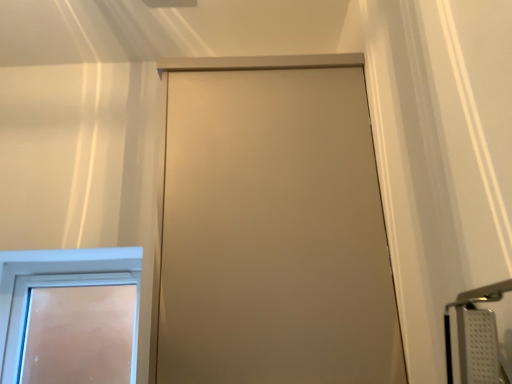
Image resolution: width=512 pixels, height=384 pixels. Describe the element at coordinates (79, 335) in the screenshot. I see `white frosted glass door at lower left, marked as the first door in a back-to-front arrangement` at that location.

Identify the location of white frosted glass door at lower left, which is the 2th door from right to left. The height and width of the screenshot is (384, 512). (79, 335).

Describe the element at coordinates (274, 232) in the screenshot. This screenshot has width=512, height=384. I see `satin beige door at center, acting as the first door starting from the front` at that location.

What is the approximate height of satin beige door at center, which is the second door from left to right?

The height of satin beige door at center, which is the second door from left to right, is 38.23 inches.

Find the location of `satin beige door at center, marked as the second door in a back-to-front arrangement`. satin beige door at center, marked as the second door in a back-to-front arrangement is located at coordinates (274, 232).

The image size is (512, 384). I want to click on white frosted glass door at lower left, marked as the first door in a left-to-right arrangement, so click(x=79, y=335).

Based on the photo, considering the positions of objects white frosted glass door at lower left, which is the 2th door from right to left, and satin beige door at center, which is the second door from left to right, in the image provided, who is more to the right, white frosted glass door at lower left, which is the 2th door from right to left, or satin beige door at center, which is the second door from left to right,?

satin beige door at center, which is the second door from left to right, is more to the right.

Is white frosted glass door at lower left, marked as the first door in a left-to-right arrangement, in front of satin beige door at center, acting as the first door starting from the front?

No, white frosted glass door at lower left, marked as the first door in a left-to-right arrangement, is behind satin beige door at center, acting as the first door starting from the front.

Which is behind, point (58, 337) or point (289, 351)?

Point (58, 337)

From the image's perspective, does white frosted glass door at lower left, which is the 2th door from right to left, appear higher than satin beige door at center, marked as the second door in a back-to-front arrangement?

Incorrect, from the image's perspective, white frosted glass door at lower left, which is the 2th door from right to left, is lower than satin beige door at center, marked as the second door in a back-to-front arrangement.

From a real-world perspective, is white frosted glass door at lower left, which is the 2th door from right to left, on top of satin beige door at center, which appears as the first door when viewed from the right?

No, from a real-world perspective, white frosted glass door at lower left, which is the 2th door from right to left, is not over satin beige door at center, which appears as the first door when viewed from the right

Looking at their sizes, would you say white frosted glass door at lower left, which is the 2th door from right to left, is wider or thinner than satin beige door at center, marked as the second door in a back-to-front arrangement?

white frosted glass door at lower left, which is the 2th door from right to left, is thinner than satin beige door at center, marked as the second door in a back-to-front arrangement.

Can you confirm if white frosted glass door at lower left, which appears as the 2th door when viewed from the front, is taller than satin beige door at center, which appears as the first door when viewed from the right?

In fact, white frosted glass door at lower left, which appears as the 2th door when viewed from the front, may be shorter than satin beige door at center, which appears as the first door when viewed from the right.

Which of these two, white frosted glass door at lower left, which appears as the 2th door when viewed from the front, or satin beige door at center, marked as the second door in a back-to-front arrangement, is bigger?

satin beige door at center, marked as the second door in a back-to-front arrangement.

Is white frosted glass door at lower left, marked as the first door in a left-to-right arrangement, surrounding satin beige door at center, acting as the first door starting from the front?

No, satin beige door at center, acting as the first door starting from the front, is not inside white frosted glass door at lower left, marked as the first door in a left-to-right arrangement.

Is white frosted glass door at lower left, marked as the first door in a left-to-right arrangement, next to satin beige door at center, acting as the first door starting from the front, and touching it?

They are not placed beside each other.

Is white frosted glass door at lower left, which is the 2th door from right to left, positioned with its back to satin beige door at center, marked as the second door in a back-to-front arrangement?

No, white frosted glass door at lower left, which is the 2th door from right to left, is not facing away from satin beige door at center, marked as the second door in a back-to-front arrangement.

What's the angular difference between white frosted glass door at lower left, which appears as the 2th door when viewed from the front, and satin beige door at center, which appears as the first door when viewed from the right,'s facing directions?

white frosted glass door at lower left, which appears as the 2th door when viewed from the front, and satin beige door at center, which appears as the first door when viewed from the right, are facing 0.38 degrees away from each other.

How distant is white frosted glass door at lower left, marked as the first door in a back-to-front arrangement, from satin beige door at center, which is the second door from left to right?

white frosted glass door at lower left, marked as the first door in a back-to-front arrangement, and satin beige door at center, which is the second door from left to right, are 9.70 feet apart from each other.

Find the location of a particular element. Image resolution: width=512 pixels, height=384 pixels. door above the white frosted glass door at lower left, marked as the first door in a back-to-front arrangement (from a real-world perspective) is located at coordinates (274, 232).

Based on their positions, is satin beige door at center, acting as the first door starting from the front, located to the left or right of white frosted glass door at lower left, which appears as the 2th door when viewed from the front?

Clearly, satin beige door at center, acting as the first door starting from the front, is on the right of white frosted glass door at lower left, which appears as the 2th door when viewed from the front, in the image.

Which is behind, satin beige door at center, acting as the first door starting from the front, or white frosted glass door at lower left, marked as the first door in a left-to-right arrangement?

white frosted glass door at lower left, marked as the first door in a left-to-right arrangement, is further away from the camera.

Which is closer, (281, 196) or (64, 372)?

Point (281, 196) appears to be closer to the viewer than point (64, 372).

From the image's perspective, between satin beige door at center, which is the second door from left to right, and white frosted glass door at lower left, marked as the first door in a left-to-right arrangement, which one is located above?

From the image's view, satin beige door at center, which is the second door from left to right, is above.

From a real-world perspective, is satin beige door at center, acting as the first door starting from the front, above or below white frosted glass door at lower left, which is the 2th door from right to left?

satin beige door at center, acting as the first door starting from the front, is above white frosted glass door at lower left, which is the 2th door from right to left.

Can you confirm if satin beige door at center, which appears as the first door when viewed from the right, is wider than white frosted glass door at lower left, which is the 2th door from right to left?

Yes.

Which of these two, satin beige door at center, which is the second door from left to right, or white frosted glass door at lower left, which appears as the 2th door when viewed from the front, stands shorter?

With less height is white frosted glass door at lower left, which appears as the 2th door when viewed from the front.

Consider the image. Who is bigger, satin beige door at center, marked as the second door in a back-to-front arrangement, or white frosted glass door at lower left, marked as the first door in a back-to-front arrangement?

Bigger between the two is satin beige door at center, marked as the second door in a back-to-front arrangement.

Is satin beige door at center, which is the second door from left to right, outside of white frosted glass door at lower left, which appears as the 2th door when viewed from the front?

Absolutely, satin beige door at center, which is the second door from left to right, is external to white frosted glass door at lower left, which appears as the 2th door when viewed from the front.

Is satin beige door at center, acting as the first door starting from the front, positioned far away from white frosted glass door at lower left, marked as the first door in a left-to-right arrangement?

Yes.

Is satin beige door at center, which appears as the first door when viewed from the right, facing towards white frosted glass door at lower left, marked as the first door in a back-to-front arrangement?

No.

Find the location of a particular element. This screenshot has width=512, height=384. door on the right side of white frosted glass door at lower left, marked as the first door in a left-to-right arrangement is located at coordinates click(274, 232).

I want to click on door below the satin beige door at center, marked as the second door in a back-to-front arrangement (from the image's perspective), so click(x=79, y=335).

Locate an element on the screen. This screenshot has height=384, width=512. door located on the right of white frosted glass door at lower left, which appears as the 2th door when viewed from the front is located at coordinates (274, 232).